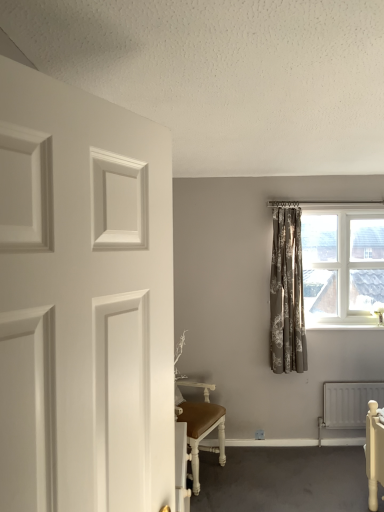
Question: Is white matte door at left taller than white textured window at upper right?

Choices:
 (A) no
 (B) yes

Answer: (A)

Question: Is white matte door at left beside white textured window at upper right?

Choices:
 (A) no
 (B) yes

Answer: (A)

Question: Does white matte door at left appear on the right side of white textured window at upper right?

Choices:
 (A) yes
 (B) no

Answer: (B)

Question: From the image's perspective, is white matte door at left located beneath white textured window at upper right?

Choices:
 (A) no
 (B) yes

Answer: (B)

Question: Is white matte door at left bigger than white textured window at upper right?

Choices:
 (A) no
 (B) yes

Answer: (A)

Question: From the image's perspective, relative to white textured window at upper right, is white matte door at left above or below?

Choices:
 (A) below
 (B) above

Answer: (A)

Question: Choose the correct answer: Is white matte door at left inside white textured window at upper right or outside it?

Choices:
 (A) outside
 (B) inside

Answer: (A)

Question: Is point (147, 448) positioned closer to the camera than point (332, 223)?

Choices:
 (A) farther
 (B) closer

Answer: (B)

Question: Looking at their shapes, would you say white matte door at left is wider or thinner than white textured window at upper right?

Choices:
 (A) wide
 (B) thin

Answer: (B)

Question: From a real-world perspective, is white matte door at left positioned above or below white metallic radiator at lower right?

Choices:
 (A) below
 (B) above

Answer: (B)

Question: Based on their positions, is white matte door at left located to the left or right of white metallic radiator at lower right?

Choices:
 (A) left
 (B) right

Answer: (A)

Question: Is white matte door at left bigger or smaller than white metallic radiator at lower right?

Choices:
 (A) small
 (B) big

Answer: (B)

Question: Relative to white metallic radiator at lower right, is white matte door at left in front or behind?

Choices:
 (A) front
 (B) behind

Answer: (A)

Question: Would you say neutral floral fabric curtain at center-right is inside or outside white metallic radiator at lower right?

Choices:
 (A) outside
 (B) inside

Answer: (A)

Question: Considering the positions of point (291, 232) and point (326, 406), is point (291, 232) closer or farther from the camera than point (326, 406)?

Choices:
 (A) farther
 (B) closer

Answer: (B)